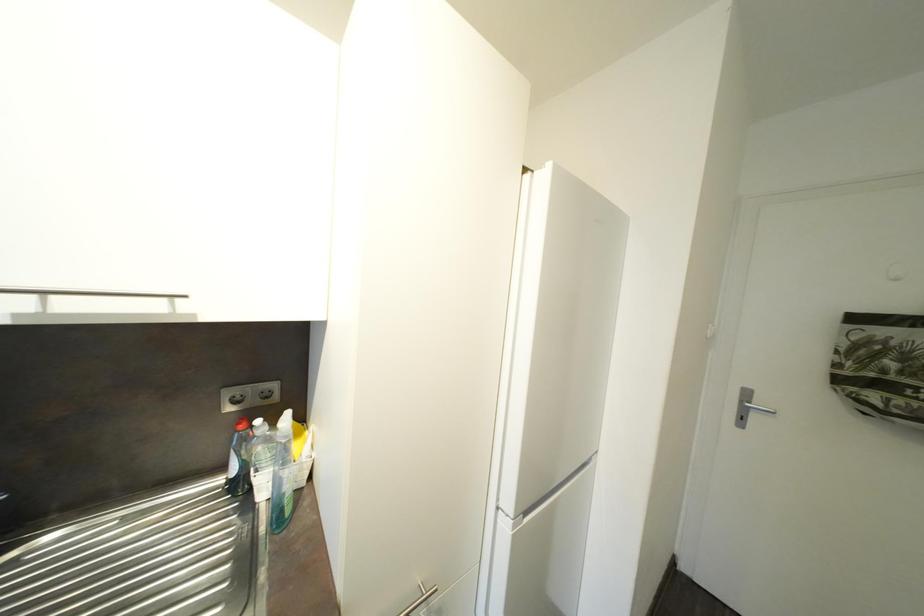
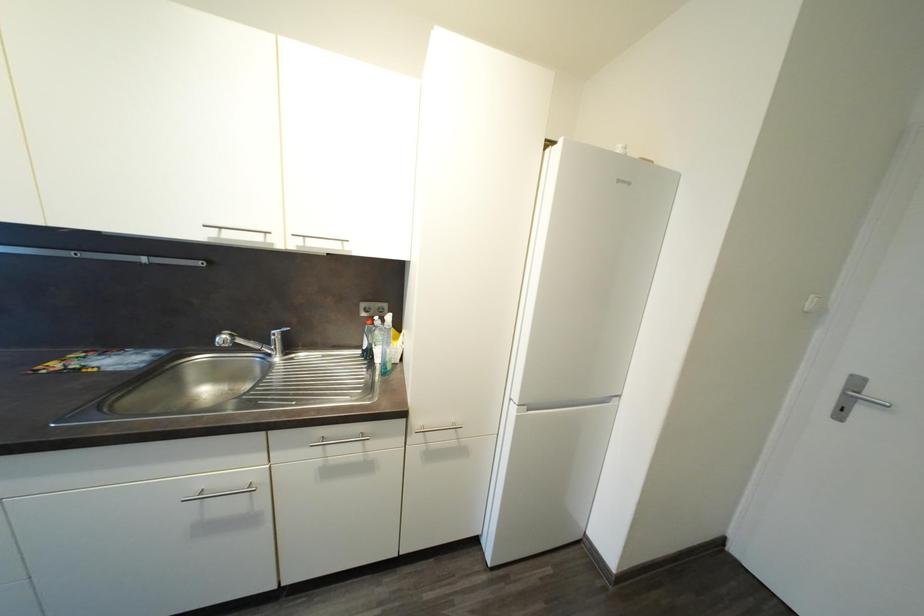
Which direction would the cameraman need to move to produce the second image?

The movement direction of the cameraman is right, backward.